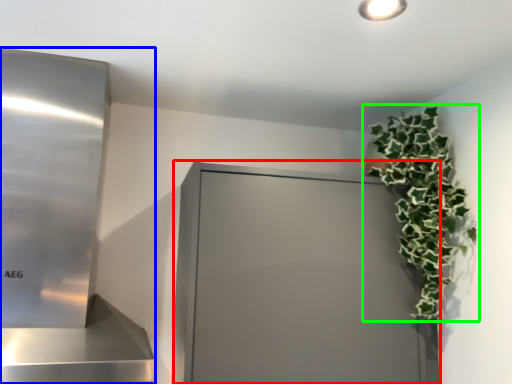
Question: Estimate the real-world distances between objects in this image. Which object is farther from glass door (highlighted by a red box), appliance (highlighted by a blue box) or houseplant (highlighted by a green box)?

Choices:
 (A) appliance
 (B) houseplant

Answer: (A)